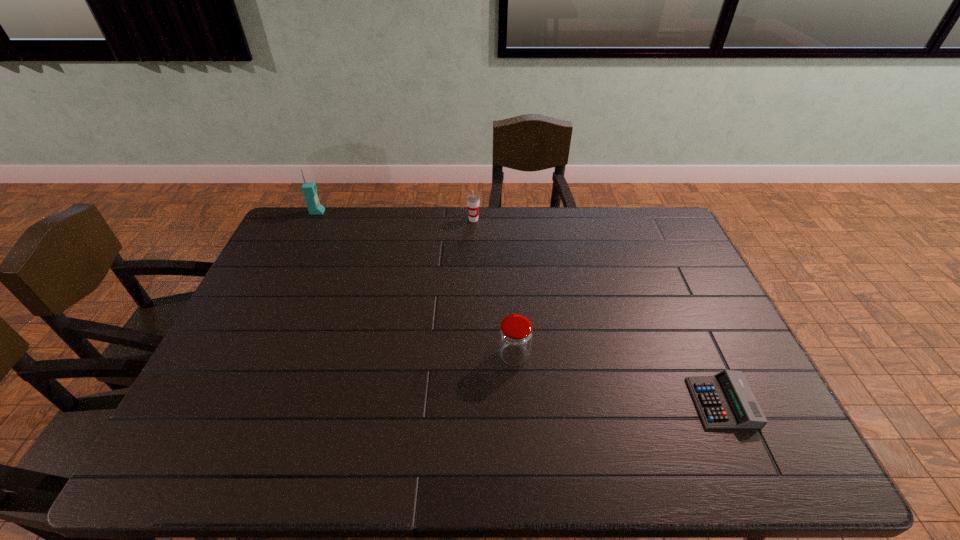
You are a GUI agent. You are given a task and a screenshot of the screen. Output one action in this format:
    pyautogui.click(x=<x>, y=<y>)
    Task: Click on the free location at the right edge
    The width and height of the screenshot is (960, 540).
    Given the screenshot: What is the action you would take?
    pyautogui.click(x=712, y=340)

Image resolution: width=960 pixels, height=540 pixels. What are the coordinates of `vacant space at the far left corner of the desktop` in the screenshot? It's located at (305, 212).

You are a GUI agent. You are given a task and a screenshot of the screen. Output one action in this format:
    pyautogui.click(x=<x>, y=<y>)
    Task: Click on the blank area at the near left corner
    The image size is (960, 540).
    Given the screenshot: What is the action you would take?
    pyautogui.click(x=170, y=460)

Find the location of a particular element. The width and height of the screenshot is (960, 540). vacant space at the far right corner of the desktop is located at coordinates (651, 242).

Where is `free point between the nearest object and the cup`? Image resolution: width=960 pixels, height=540 pixels. free point between the nearest object and the cup is located at coordinates (598, 311).

You are a GUI agent. You are given a task and a screenshot of the screen. Output one action in this format:
    pyautogui.click(x=<x>, y=<y>)
    Task: Click on the vacant area between the third nearest object and the rightmost object
    
    Given the screenshot: What is the action you would take?
    598,311

I want to click on vacant point located between the second object from left to right and the second object from right to left, so click(493, 288).

Find the location of a particular element. This screenshot has height=540, width=960. vacant space that's between the cup and the rightmost object is located at coordinates (598, 311).

Image resolution: width=960 pixels, height=540 pixels. Find the location of `vacant area that lies between the third object from right to left and the tallest object`. vacant area that lies between the third object from right to left and the tallest object is located at coordinates (396, 216).

At what (x,y) coordinates should I click in order to perform the action: click on vacant area between the third object from left to right and the rightmost object. Please return your answer as a coordinate pair (x, y). Looking at the image, I should click on (618, 379).